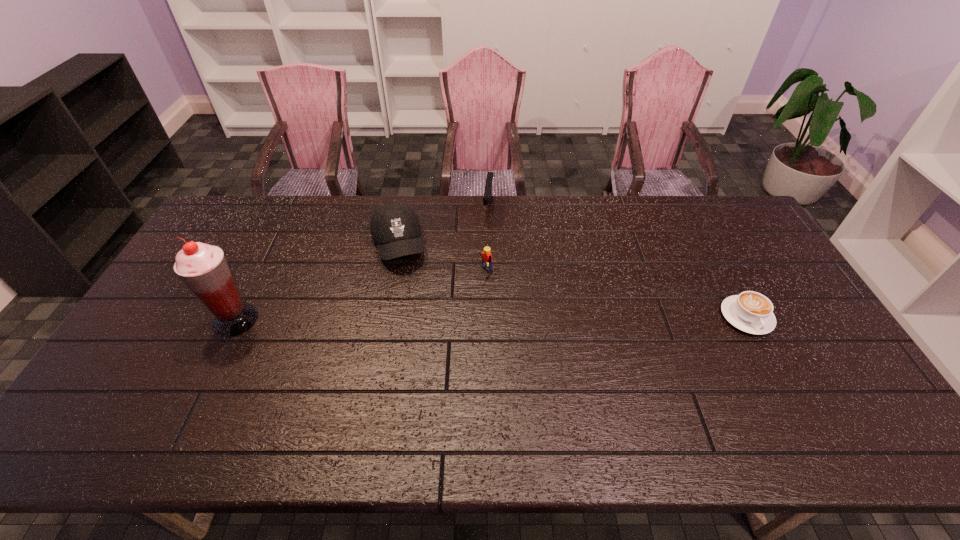
Image resolution: width=960 pixels, height=540 pixels. I want to click on free space on the desktop that is between the leftmost object and the cappuccino and is positioned on the front-facing side of the Lego, so click(x=421, y=319).

At what (x,y) coordinates should I click in order to perform the action: click on free spot on the desktop that is between the leftmost object and the rightmost object and is positioned on the front-facing side of the baseball cap. Please return your answer as a coordinate pair (x, y). The height and width of the screenshot is (540, 960). Looking at the image, I should click on (420, 319).

Find the location of a particular element. The width and height of the screenshot is (960, 540). free space on the desktop that is between the tallest object and the shortest object and is positioned on the front-facing side of the pistol is located at coordinates (472, 319).